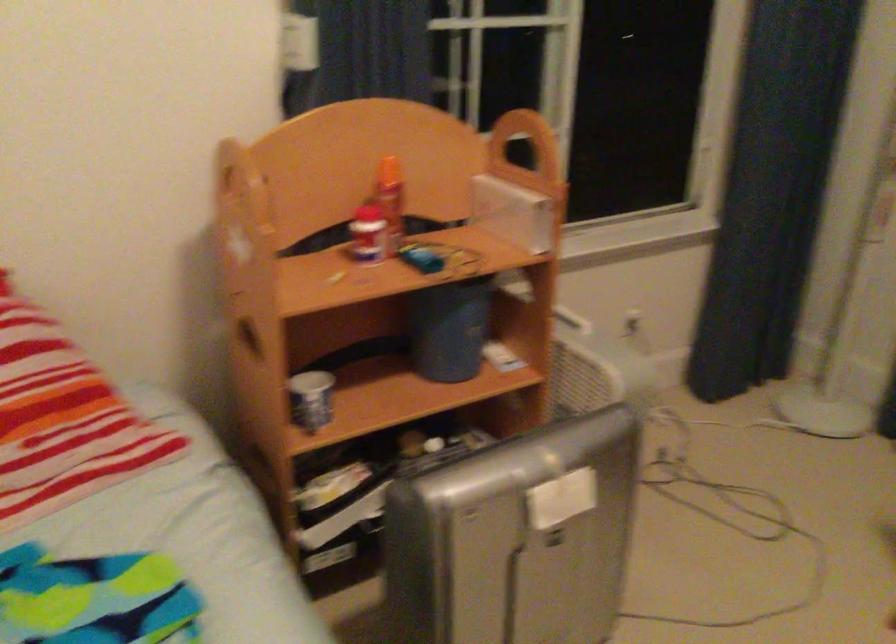
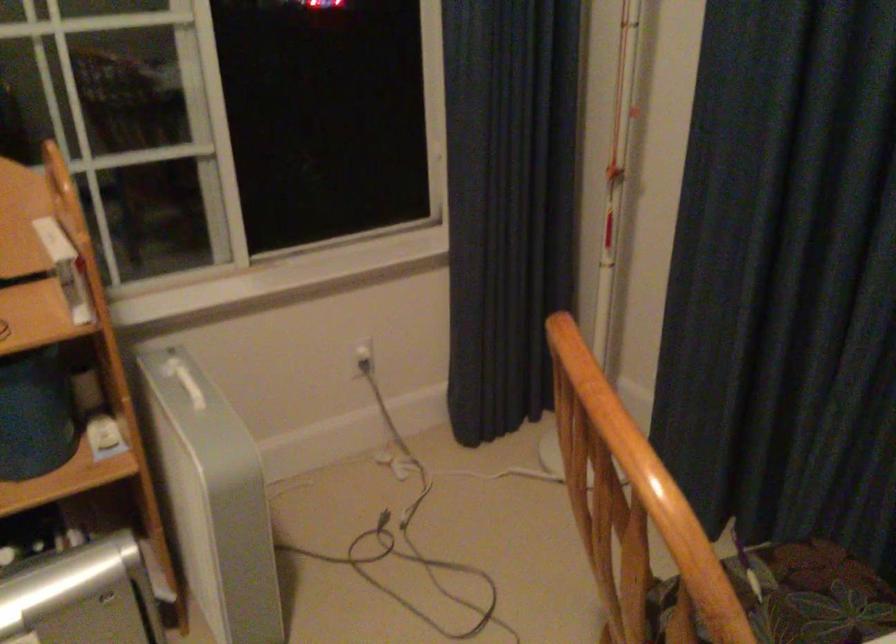
Question: I am providing you with two images of the same scene from different viewpoints. After the viewpoint changes to image2, which objects are now occluded?

Choices:
 (A) shelf unit handle
 (B) white rectangular box
 (C) white plastic trashcan
 (D) white electrical plug

Answer: (A)